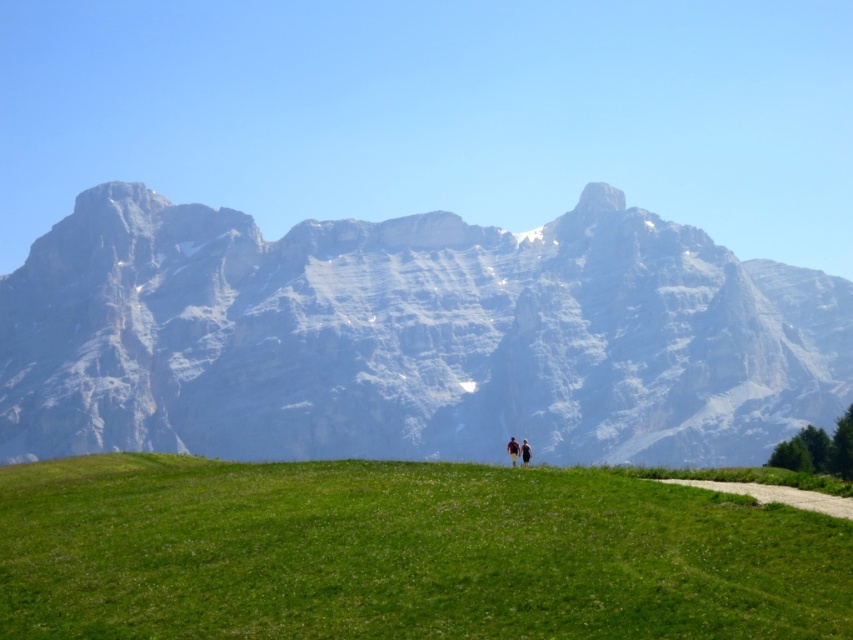
Locate an element on the screen. The width and height of the screenshot is (853, 640). light brown fabric person at center is located at coordinates 512,449.

Does light brown fabric person at center have a larger size compared to dark brown leather jacket at center?

Indeed, light brown fabric person at center has a larger size compared to dark brown leather jacket at center.

Is point (511, 449) in front of point (524, 461)?

No, (511, 449) is further to viewer.

Locate an element on the screen. Image resolution: width=853 pixels, height=640 pixels. light brown fabric person at center is located at coordinates (512, 449).

Is gray rocky mountain range at upper center shorter than red fabric couple at center?

Incorrect, gray rocky mountain range at upper center's height does not fall short of red fabric couple at center's.

Who is taller, gray rocky mountain range at upper center or red fabric couple at center?

With more height is gray rocky mountain range at upper center.

Is point (837, 284) farther from camera compared to point (525, 452)?

Yes, it is behind point (525, 452).

The width and height of the screenshot is (853, 640). I want to click on gray rocky mountain range at upper center, so click(410, 337).

Between point (515, 454) and point (527, 465), which one is positioned in front?

Positioned in front is point (527, 465).

Who is higher up, red fabric couple at center or dark brown leather jacket at center?

Positioned higher is dark brown leather jacket at center.

Is point (523, 449) positioned after point (524, 460)?

Yes, point (523, 449) is farther from viewer.

The image size is (853, 640). What are the coordinates of `red fabric couple at center` in the screenshot? It's located at (518, 451).